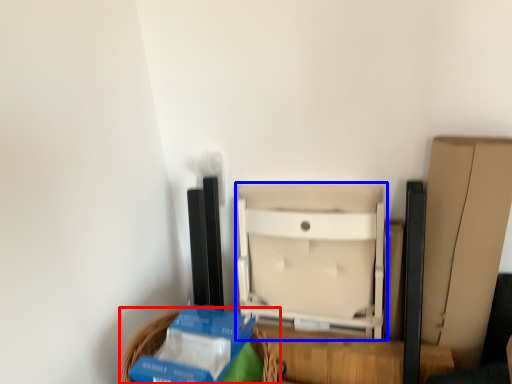
Question: Which object is further to the camera taking this photo, basket (highlighted by a red box) or furniture (highlighted by a blue box)?

Choices:
 (A) basket
 (B) furniture

Answer: (B)